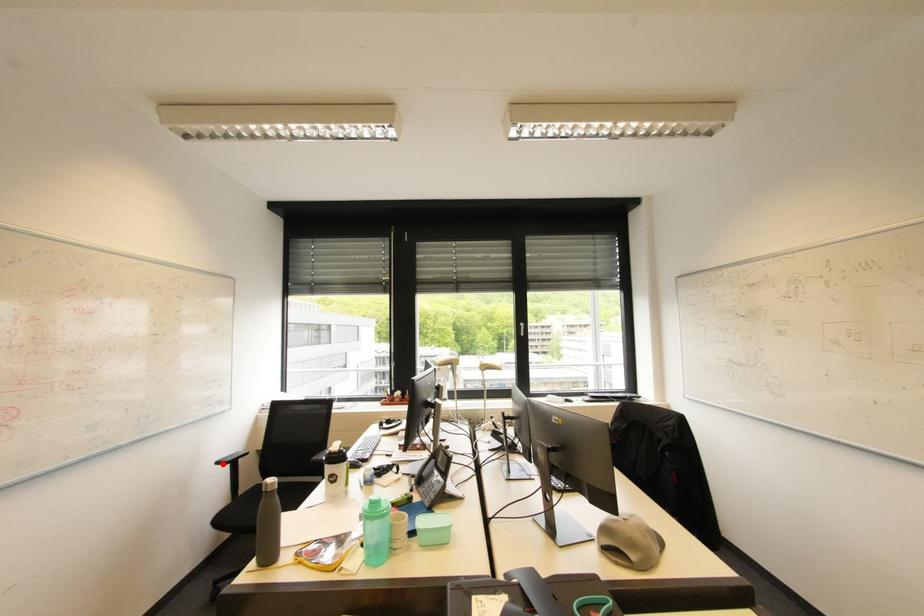
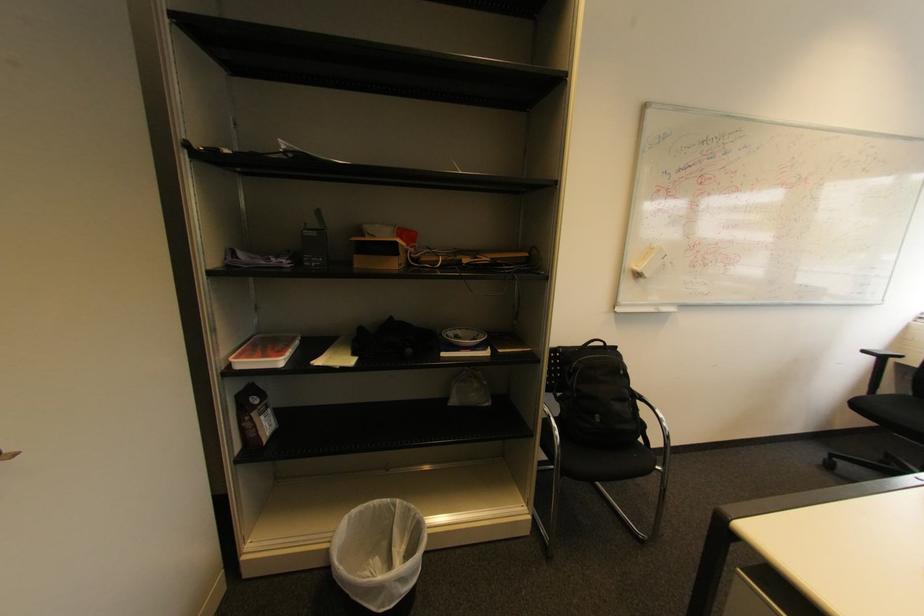
Question: I am providing you with two images of the same scene from different viewpoints. Given a red point in image1, look at the same physical point in image2. Is it:

Choices:
 (A) Closer to the viewpoint
 (B) Farther from the viewpoint

Answer: (B)